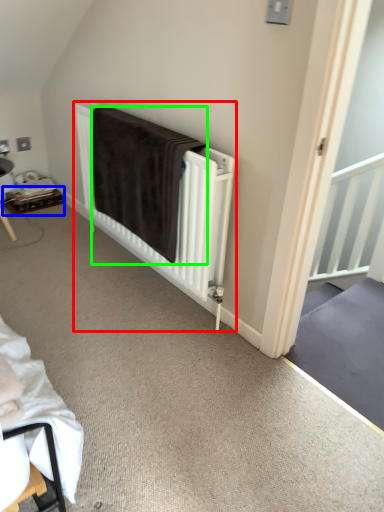
Question: Based on their relative distances, which object is farther from bed (highlighted by a red box)? Choose from table (highlighted by a blue box) and blanket (highlighted by a green box).

Choices:
 (A) table
 (B) blanket

Answer: (A)